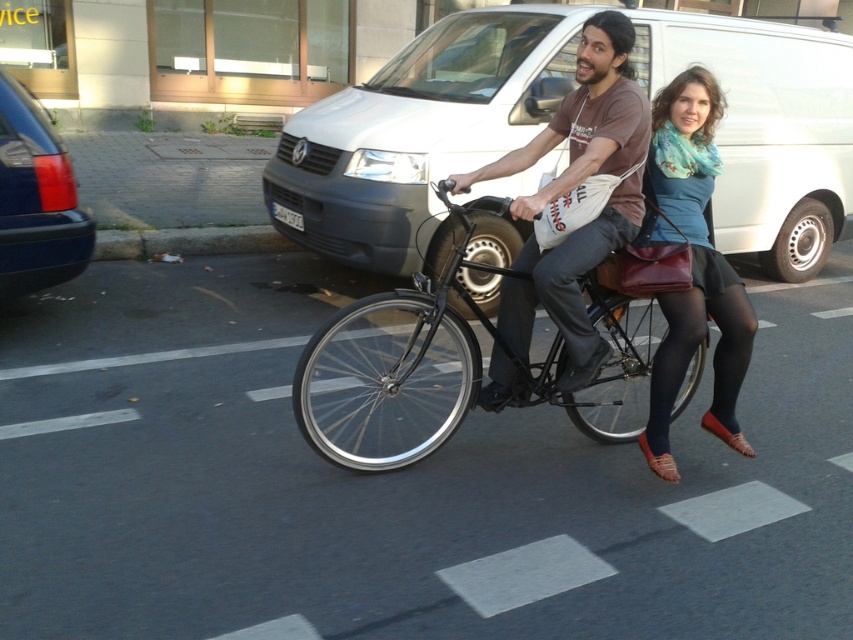
Question: Is white matte van at center positioned at the back of blue jersey at center?

Choices:
 (A) no
 (B) yes

Answer: (B)

Question: Among these points, which one is farthest from the camera?

Choices:
 (A) (54, 145)
 (B) (379, 294)
 (C) (801, 100)

Answer: (C)

Question: Where is blue jersey at center located in relation to metallic blue car at left in the image?

Choices:
 (A) above
 (B) below

Answer: (B)

Question: Can you confirm if white matte van at center is positioned to the left of metallic blue car at left?

Choices:
 (A) yes
 (B) no

Answer: (B)

Question: Which is farther from the metallic blue car at left?

Choices:
 (A) blue jersey at center
 (B) white matte van at center
 (C) shiny black bicycle at center
 (D) matte brown shirt at center

Answer: (A)

Question: Which of these objects is positioned farthest from the blue jersey at center?

Choices:
 (A) metallic blue car at left
 (B) matte brown shirt at center
 (C) shiny black bicycle at center

Answer: (A)